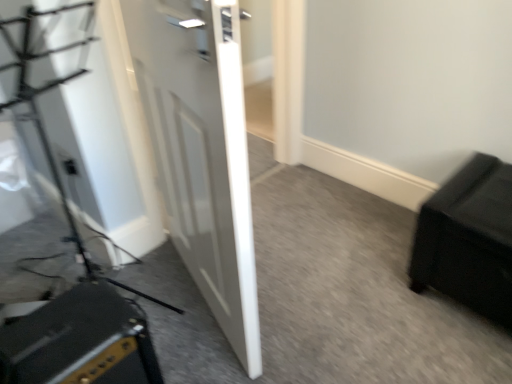
Describe the element at coordinates (69, 166) in the screenshot. I see `matte black outlet at lower left` at that location.

The width and height of the screenshot is (512, 384). What do you see at coordinates (468, 239) in the screenshot?
I see `black leather ottoman at lower right` at bounding box center [468, 239].

Where is `white glossy door at center`? Image resolution: width=512 pixels, height=384 pixels. white glossy door at center is located at coordinates (x=201, y=151).

Considering the relative sizes of matte black outlet at lower left and black leather ottoman at lower right in the image provided, is matte black outlet at lower left taller than black leather ottoman at lower right?

No.

Is matte black outlet at lower left facing towards black leather ottoman at lower right?

No, matte black outlet at lower left is not facing towards black leather ottoman at lower right.

Is matte black outlet at lower left outside of black leather ottoman at lower right?

That's correct, matte black outlet at lower left is outside of black leather ottoman at lower right.

Can you confirm if matte black outlet at lower left is wider than black leather ottoman at lower right?

No, matte black outlet at lower left is not wider than black leather ottoman at lower right.

Is point (32, 360) behind point (74, 171)?

No, it is not.

Image resolution: width=512 pixels, height=384 pixels. Find the location of `electric outlet above the black matte speaker at lower left (from the image's perspective)`. electric outlet above the black matte speaker at lower left (from the image's perspective) is located at coordinates (69, 166).

Considering the positions of objects black matte speaker at lower left and matte black outlet at lower left in the image provided, who is behind, black matte speaker at lower left or matte black outlet at lower left?

matte black outlet at lower left is further away from the camera.

Which of these two, black matte speaker at lower left or matte black outlet at lower left, is thinner?

With smaller width is matte black outlet at lower left.

Which of these two, black leather ottoman at lower right or matte black outlet at lower left, is wider?

black leather ottoman at lower right is wider.

Would you consider black leather ottoman at lower right to be distant from matte black outlet at lower left?

black leather ottoman at lower right is far away from matte black outlet at lower left.

Is black leather ottoman at lower right to the left of matte black outlet at lower left from the viewer's perspective?

No, black leather ottoman at lower right is not to the left of matte black outlet at lower left.

From the image's perspective, is black leather ottoman at lower right located above or below matte black outlet at lower left?

black leather ottoman at lower right is below matte black outlet at lower left.

Between matte black outlet at lower left and black matte speaker at lower left, which one has less height?

matte black outlet at lower left.

Can you tell me how much matte black outlet at lower left and black matte speaker at lower left differ in facing direction?

They differ by 91 degrees in their facing directions.

From a real-world perspective, which is physically above, matte black outlet at lower left or black matte speaker at lower left?

From a 3D spatial view, matte black outlet at lower left is above.

Is matte black outlet at lower left looking in the opposite direction of black matte speaker at lower left?

matte black outlet at lower left is not turned away from black matte speaker at lower left.

Is black matte speaker at lower left a part of black leather ottoman at lower right?

No, black leather ottoman at lower right does not contain black matte speaker at lower left.

From the image's perspective, between black leather ottoman at lower right and black matte speaker at lower left, which one is located above?

From the image's view, black leather ottoman at lower right is above.

Considering the relative sizes of black leather ottoman at lower right and black matte speaker at lower left in the image provided, is black leather ottoman at lower right taller than black matte speaker at lower left?

Indeed, black leather ottoman at lower right has a greater height compared to black matte speaker at lower left.

Between black leather ottoman at lower right and black matte speaker at lower left, which one is positioned in front?

black matte speaker at lower left is closer to the camera.

Which is correct: black matte speaker at lower left is inside white glossy door at center, or outside of it?

Answer: black matte speaker at lower left is not enclosed by white glossy door at center.

Where is `speaker below the white glossy door at center (from the image's perspective)`? The width and height of the screenshot is (512, 384). speaker below the white glossy door at center (from the image's perspective) is located at coordinates (80, 341).

Is black matte speaker at lower left positioned in front of white glossy door at center?

No.

Which is more to the right, white glossy door at center or matte black outlet at lower left?

From the viewer's perspective, white glossy door at center appears more on the right side.

Is white glossy door at center oriented towards matte black outlet at lower left?

Yes, white glossy door at center faces towards matte black outlet at lower left.

Between white glossy door at center and matte black outlet at lower left, which one has more height?

white glossy door at center is taller.

I want to click on electric outlet lying behind the black leather ottoman at lower right, so click(69, 166).

Locate an element on the screen. This screenshot has width=512, height=384. speaker below the matte black outlet at lower left (from a real-world perspective) is located at coordinates (80, 341).

Estimate the real-world distances between objects in this image. Which object is closer to white glossy door at center, matte black outlet at lower left or black leather ottoman at lower right?

Based on the image, matte black outlet at lower left appears to be nearer to white glossy door at center.

Considering their positions, is matte black outlet at lower left positioned closer to black leather ottoman at lower right than black matte speaker at lower left?

black matte speaker at lower left lies closer to black leather ottoman at lower right than the other object.

From the image, which object appears to be farther from black matte speaker at lower left, white glossy door at center or black leather ottoman at lower right?

black leather ottoman at lower right lies further to black matte speaker at lower left than the other object.

Estimate the real-world distances between objects in this image. Which object is further from white glossy door at center, matte black outlet at lower left or black matte speaker at lower left?

matte black outlet at lower left is further to white glossy door at center.

From the picture: Which object lies further to the anchor point black matte speaker at lower left, matte black outlet at lower left or white glossy door at center?

Based on the image, matte black outlet at lower left appears to be further to black matte speaker at lower left.

When comparing their distances from black matte speaker at lower left, does matte black outlet at lower left or black leather ottoman at lower right seem further?

black leather ottoman at lower right.

Consider the image. Looking at the image, which one is located further to white glossy door at center, black matte speaker at lower left or black leather ottoman at lower right?

black leather ottoman at lower right lies further to white glossy door at center than the other object.

Looking at the image, which one is located further to matte black outlet at lower left, white glossy door at center or black matte speaker at lower left?

The object further to matte black outlet at lower left is black matte speaker at lower left.

You are a GUI agent. You are given a task and a screenshot of the screen. Output one action in this format:
    pyautogui.click(x=<x>, y=<y>)
    Task: Click on the speaker between matte black outlet at lower left and black leather ottoman at lower right from left to right
    
    Given the screenshot: What is the action you would take?
    pyautogui.click(x=80, y=341)

This screenshot has width=512, height=384. Find the location of `speaker between white glossy door at center and matte black outlet at lower left from front to back`. speaker between white glossy door at center and matte black outlet at lower left from front to back is located at coordinates (80, 341).

You are a GUI agent. You are given a task and a screenshot of the screen. Output one action in this format:
    pyautogui.click(x=<x>, y=<y>)
    Task: Click on the door located between matte black outlet at lower left and black leather ottoman at lower right in the left-right direction
    The height and width of the screenshot is (384, 512).
    Given the screenshot: What is the action you would take?
    pyautogui.click(x=201, y=151)

Locate an element on the screen. This screenshot has height=384, width=512. door between black matte speaker at lower left and black leather ottoman at lower right is located at coordinates (201, 151).